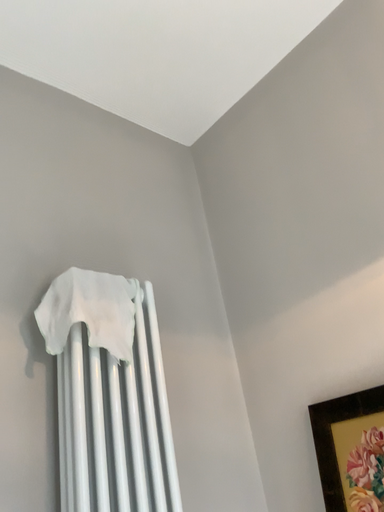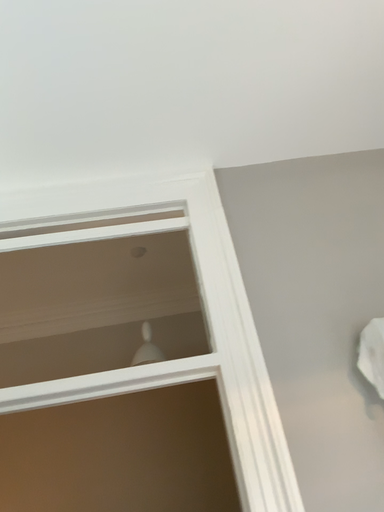
Question: How did the camera likely rotate when shooting the video?

Choices:
 (A) rotated upward
 (B) rotated downward

Answer: (B)